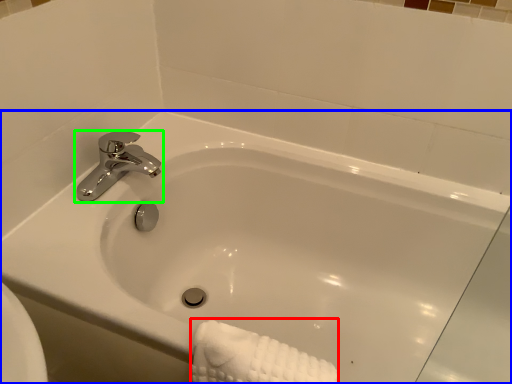
Question: Based on their relative distances, which object is farther from bath towel (highlighted by a red box)? Choose from bathtub (highlighted by a blue box) and tap (highlighted by a green box).

Choices:
 (A) bathtub
 (B) tap

Answer: (B)